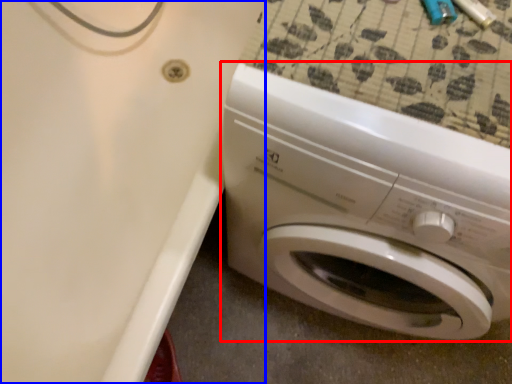
Question: Which of the following is the farthest to the observer, washing machine (highlighted by a red box) or bath (highlighted by a blue box)?

Choices:
 (A) washing machine
 (B) bath

Answer: (B)